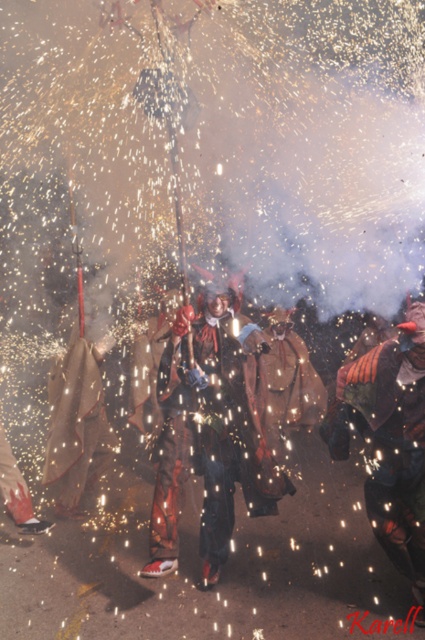
Looking at this image, is shiny metallic costume at center positioned in front of velvet orange cape at center?

That is False.

Measure the distance between shiny metallic costume at center and camera.

They are 4.77 meters apart.

Identify the location of shiny metallic costume at center. (203, 435).